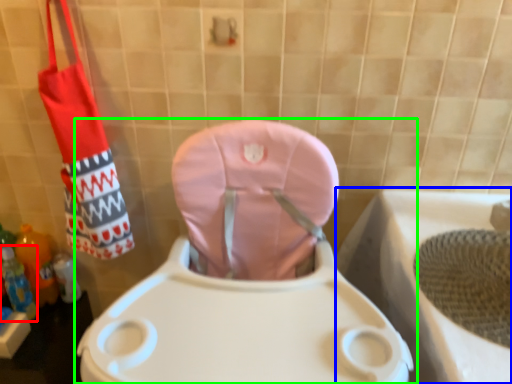
Question: Estimate the real-world distances between objects in this image. Which object is farther from bottle (highlighted by a red box), bath (highlighted by a blue box) or toilet (highlighted by a green box)?

Choices:
 (A) bath
 (B) toilet

Answer: (A)